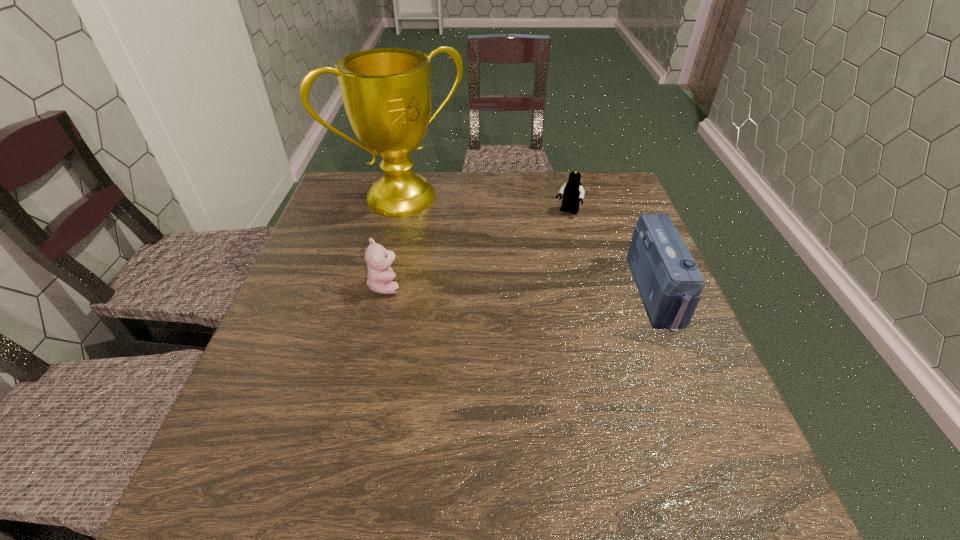
Locate an element on the screen. The width and height of the screenshot is (960, 540). vacant position located on the front-facing side of the third object from left to right is located at coordinates (543, 252).

Where is `award present at the far edge`? award present at the far edge is located at coordinates (386, 92).

This screenshot has height=540, width=960. Find the location of `Lego located at the far edge`. Lego located at the far edge is located at coordinates (573, 192).

Find the location of a particular element. The height and width of the screenshot is (540, 960). object positioned at the left edge is located at coordinates (386, 92).

At what (x,y) coordinates should I click in order to perform the action: click on camera that is at the right edge. Please return your answer as a coordinate pair (x, y). The width and height of the screenshot is (960, 540). Looking at the image, I should click on (669, 282).

Identify the location of Lego present at the right edge. This screenshot has height=540, width=960. (573, 192).

Image resolution: width=960 pixels, height=540 pixels. Find the location of `object that is positioned at the far left corner`. object that is positioned at the far left corner is located at coordinates (386, 92).

You are a GUI agent. You are given a task and a screenshot of the screen. Output one action in this format:
    pyautogui.click(x=<x>, y=<y>)
    Task: Click on the object located in the far right corner section of the desktop
    Image resolution: width=960 pixels, height=540 pixels.
    Given the screenshot: What is the action you would take?
    pyautogui.click(x=573, y=192)

Locate an element on the screen. blank space at the far edge is located at coordinates (469, 180).

This screenshot has height=540, width=960. What are the coordinates of `vacant region at the near edge` in the screenshot? It's located at (583, 442).